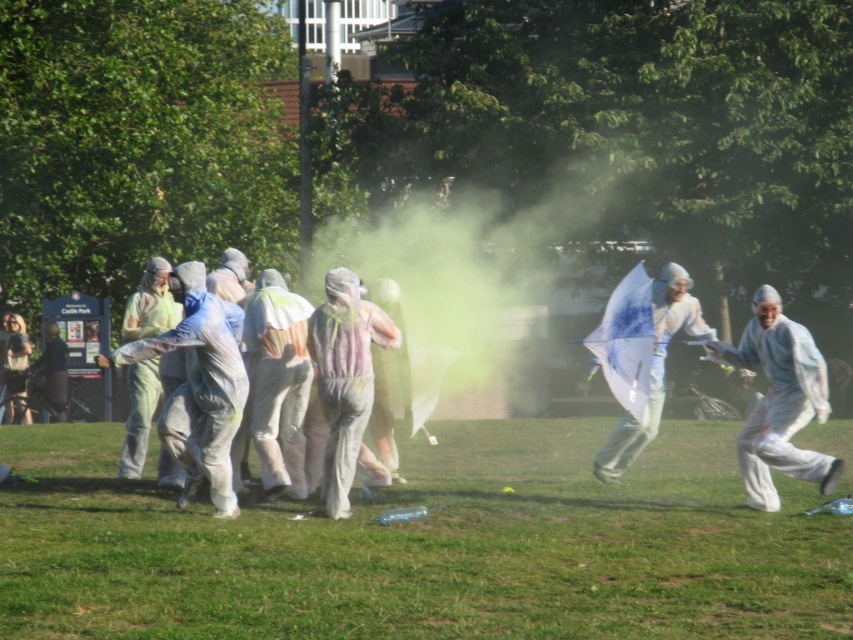
Is point (258, 352) positioned in front of point (618, 442)?

Yes.

Does white matte jumpsuit at center appear on the right side of white matte umbrella at right?

Incorrect, white matte jumpsuit at center is not on the right side of white matte umbrella at right.

At what (x,y) coordinates should I click in order to perform the action: click on white matte jumpsuit at center. Please return your answer as a coordinate pair (x, y). The width and height of the screenshot is (853, 640). Looking at the image, I should click on (277, 381).

Where is `white matte jumpsuit at center`? This screenshot has width=853, height=640. white matte jumpsuit at center is located at coordinates (277, 381).

Is white matte jumpsuit at right closer to the viewer compared to white matte jumpsuit at center?

Yes.

Image resolution: width=853 pixels, height=640 pixels. Describe the element at coordinates (779, 401) in the screenshot. I see `white matte jumpsuit at right` at that location.

What do you see at coordinates (779, 401) in the screenshot? I see `white matte jumpsuit at right` at bounding box center [779, 401].

Find the location of a particular element. white matte jumpsuit at right is located at coordinates (779, 401).

What do you see at coordinates (277, 381) in the screenshot? This screenshot has width=853, height=640. I see `white matte jumpsuit at center` at bounding box center [277, 381].

Between white matte jumpsuit at center and rainbow-colored fabric at center, which one is positioned lower?

rainbow-colored fabric at center is lower down.

The width and height of the screenshot is (853, 640). Identify the location of white matte jumpsuit at center. (277, 381).